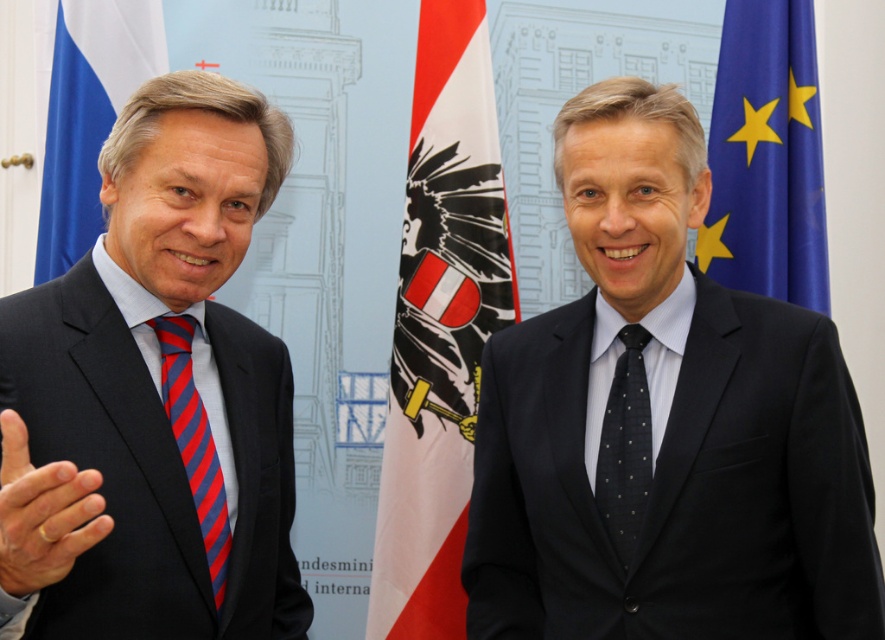
Which is behind, point (87, 44) or point (204, 474)?

The point (87, 44) is more distant.

Identify the location of blue fabric flag at left. (88, 115).

Locate an element on the screen. The height and width of the screenshot is (640, 885). blue fabric flag at left is located at coordinates (88, 115).

Where is `blue fabric flag at left`? blue fabric flag at left is located at coordinates (88, 115).

Is point (513, 560) closer to viewer compared to point (421, 467)?

Yes, point (513, 560) is in front of point (421, 467).

Does dark blue suit at right appear under white/red fabric flag at center?

Correct, dark blue suit at right is located below white/red fabric flag at center.

Is point (610, 300) positioned in front of point (422, 314)?

Yes, it is.

This screenshot has height=640, width=885. What are the coordinates of `dark blue suit at right` in the screenshot? It's located at (664, 426).

Who is positioned more to the right, white/red fabric flag at center or matte black hand at left?

white/red fabric flag at center

Can you confirm if white/red fabric flag at center is smaller than matte black hand at left?

Incorrect, white/red fabric flag at center is not smaller in size than matte black hand at left.

The width and height of the screenshot is (885, 640). What do you see at coordinates (440, 326) in the screenshot?
I see `white/red fabric flag at center` at bounding box center [440, 326].

Where is `white/red fabric flag at center`? Image resolution: width=885 pixels, height=640 pixels. white/red fabric flag at center is located at coordinates (440, 326).